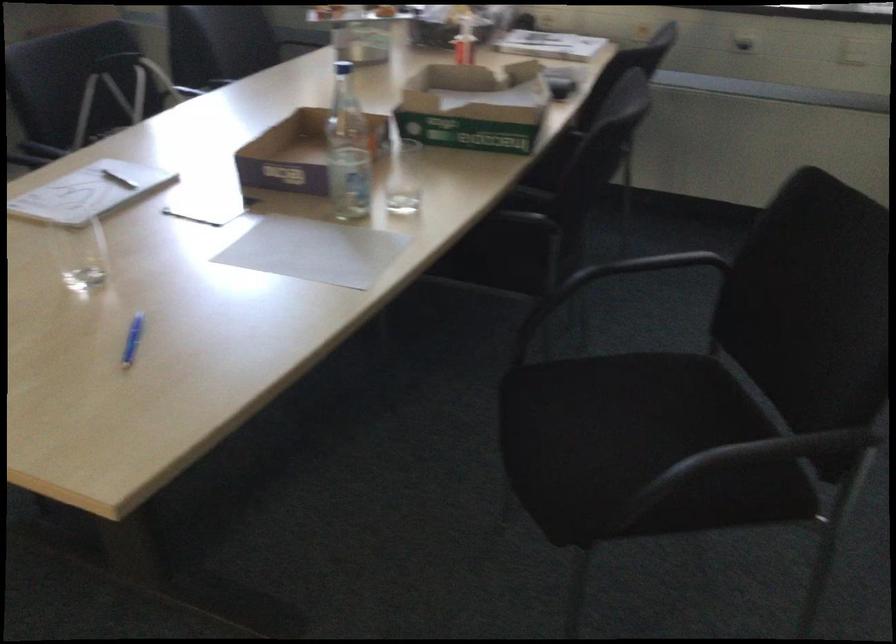
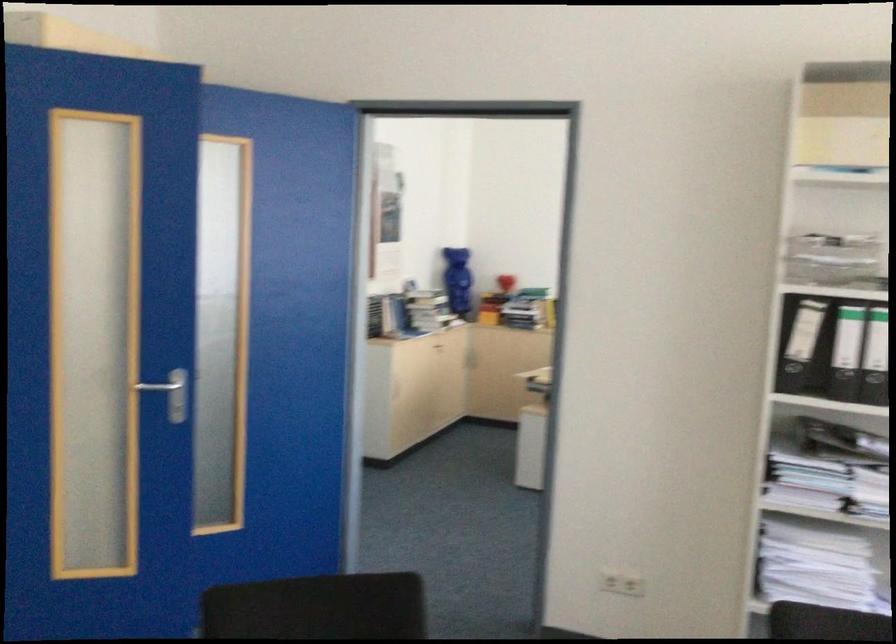
Question: The first image is from the beginning of the video and the second image is from the end. How did the camera likely rotate when shooting the video?

Choices:
 (A) Left
 (B) Right
 (C) Up
 (D) Down

Answer: (A)